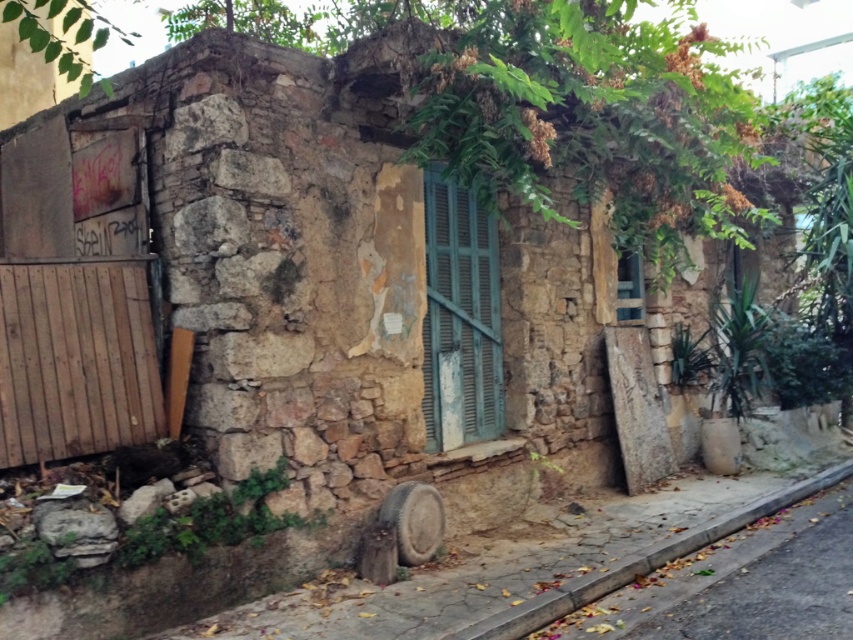
You are standing in front of the old stone building. There is a point marked at coordinates (460, 317). What object is located at that point?

The point at coordinates (460, 317) indicates the green painted wood shutter at center.